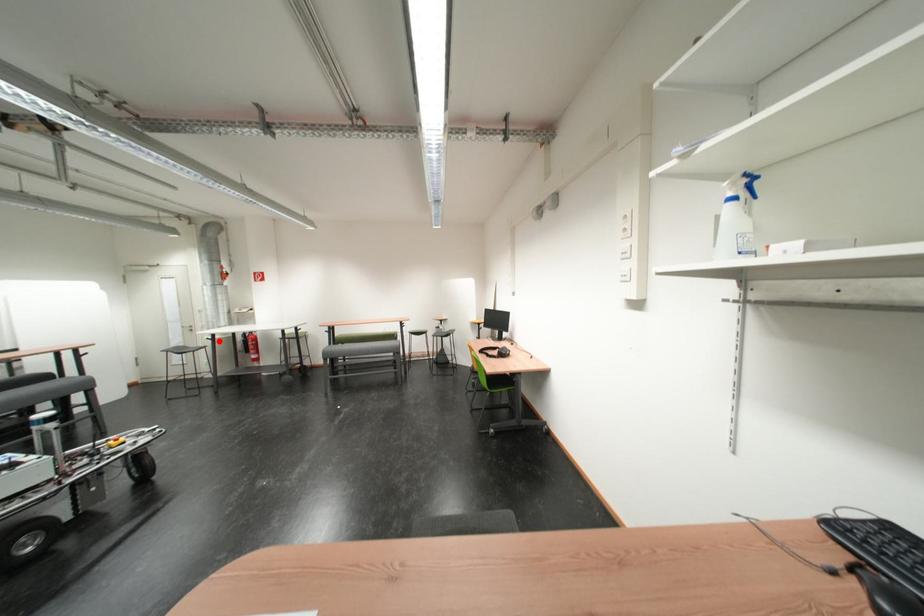
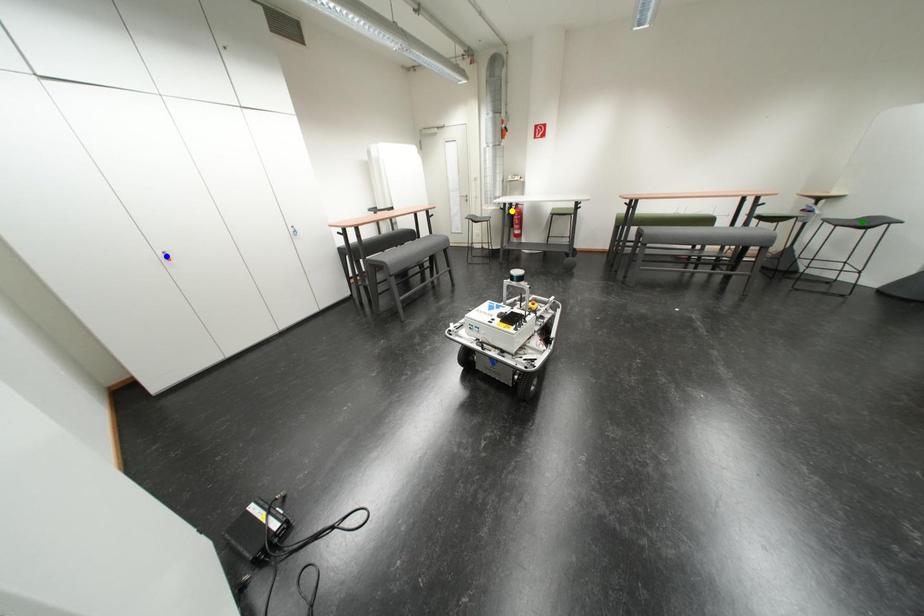
Question: I am providing you with two images of the same scene from different viewpoints. A red point is marked on the first image. You are given multiple points on the second image. Which spot in image 2 lines up with the point in image 1?

Choices:
 (A) blue point
 (B) green point
 (C) yellow point

Answer: (C)